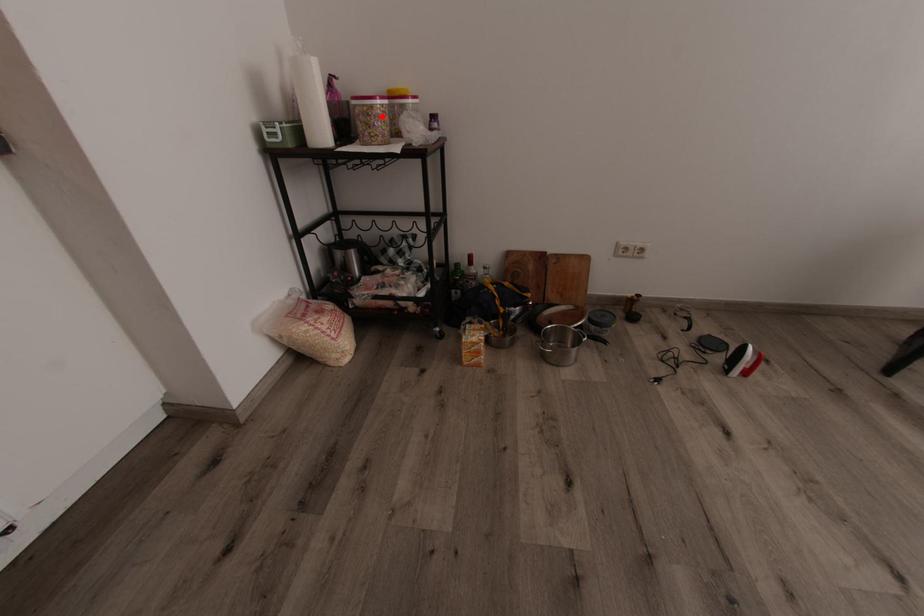
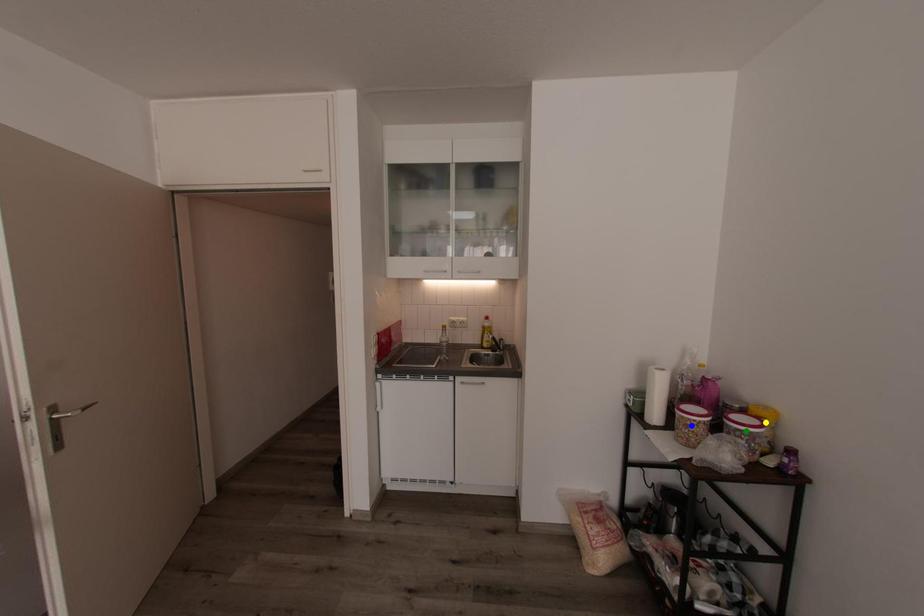
Question: I am providing you with two images of the same scene from different viewpoints. A red point is marked on the first image. You are given multiple points on the second image. Which spot in image 2 lines up with the point in image 1?

Choices:
 (A) blue point
 (B) yellow point
 (C) green point

Answer: (A)